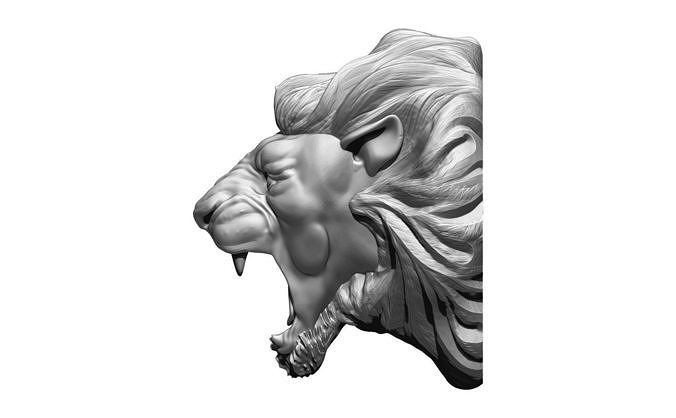
Locate an element on the screen. Image resolution: width=676 pixels, height=418 pixels. statue is located at coordinates (335, 221).